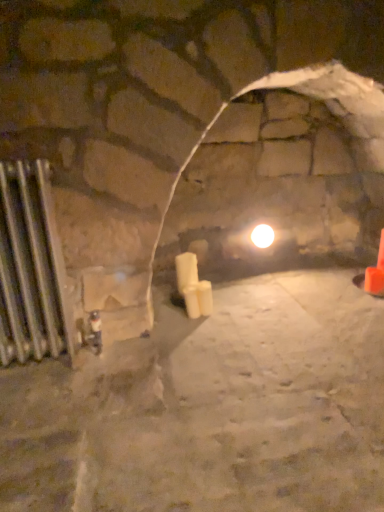
Question: Can you confirm if white matte candle at center is shorter than orange plastic traffic cone at right?

Choices:
 (A) no
 (B) yes

Answer: (B)

Question: Can you see white matte candle at center touching orange plastic traffic cone at right?

Choices:
 (A) no
 (B) yes

Answer: (A)

Question: Does white matte candle at center turn towards orange plastic traffic cone at right?

Choices:
 (A) yes
 (B) no

Answer: (B)

Question: From a real-world perspective, is white matte candle at center under orange plastic traffic cone at right?

Choices:
 (A) no
 (B) yes

Answer: (B)

Question: Considering the relative positions of white matte candle at center and orange plastic traffic cone at right in the image provided, is white matte candle at center to the left of orange plastic traffic cone at right from the viewer's perspective?

Choices:
 (A) no
 (B) yes

Answer: (B)

Question: Can you confirm if white matte candle at center is wider than orange plastic traffic cone at right?

Choices:
 (A) yes
 (B) no

Answer: (B)

Question: From the image's perspective, is orange plastic traffic cone at right under silver metallic radiator at left?

Choices:
 (A) yes
 (B) no

Answer: (B)

Question: Is orange plastic traffic cone at right in contact with silver metallic radiator at left?

Choices:
 (A) yes
 (B) no

Answer: (B)

Question: Does orange plastic traffic cone at right have a greater width compared to silver metallic radiator at left?

Choices:
 (A) yes
 (B) no

Answer: (B)

Question: From a real-world perspective, is orange plastic traffic cone at right positioned over silver metallic radiator at left based on gravity?

Choices:
 (A) yes
 (B) no

Answer: (B)

Question: Is orange plastic traffic cone at right shorter than silver metallic radiator at left?

Choices:
 (A) yes
 (B) no

Answer: (A)

Question: Does orange plastic traffic cone at right appear on the right side of silver metallic radiator at left?

Choices:
 (A) no
 (B) yes

Answer: (B)

Question: Is white matte candle at center surrounding silver metallic radiator at left?

Choices:
 (A) no
 (B) yes

Answer: (A)